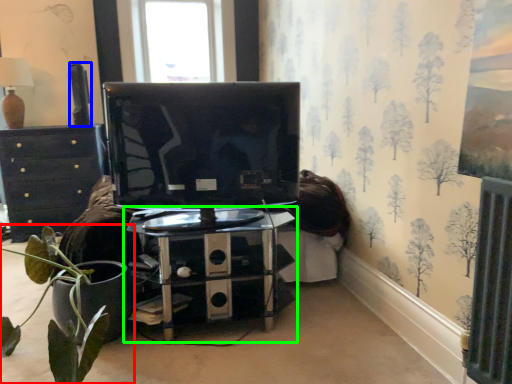
Question: Estimate the real-world distances between objects in this image. Which object is closer to houseplant (highlighted by a red box), speaker (highlighted by a blue box) or table (highlighted by a green box)?

Choices:
 (A) speaker
 (B) table

Answer: (B)